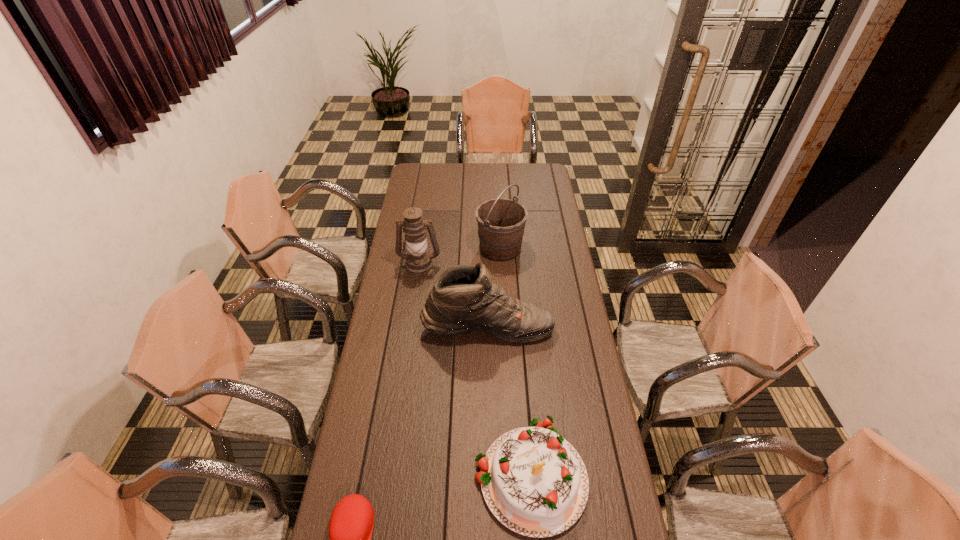
The width and height of the screenshot is (960, 540). What are the coordinates of `cake located in the right edge section of the desktop` in the screenshot? It's located at (535, 483).

Locate an element on the screen. free location at the far edge of the desktop is located at coordinates (462, 172).

I want to click on vacant space at the left edge of the desktop, so click(414, 186).

Locate an element on the screen. vacant space at the right edge of the desktop is located at coordinates (536, 246).

In the image, there is a desktop. What are the coordinates of `vacant space at the far right corner` in the screenshot? It's located at (530, 165).

Find the location of a particular element. Image resolution: width=960 pixels, height=540 pixels. unoccupied position between the ski boot and the second shortest object is located at coordinates (509, 400).

You are a GUI agent. You are given a task and a screenshot of the screen. Output one action in this format:
    pyautogui.click(x=<x>, y=<y>)
    Task: Click on the free area in between the second shortest object and the oil lamp
    The image size is (960, 540).
    Given the screenshot: What is the action you would take?
    pyautogui.click(x=475, y=369)

Locate an element on the screen. unoccupied area between the bucket and the oil lamp is located at coordinates coord(460,256).

At what (x,y) coordinates should I click in order to perform the action: click on free area in between the oil lamp and the bucket. Please return your answer as a coordinate pair (x, y). Looking at the image, I should click on (460, 256).

Locate an element on the screen. This screenshot has width=960, height=540. vacant region between the oil lamp and the bucket is located at coordinates (460, 256).